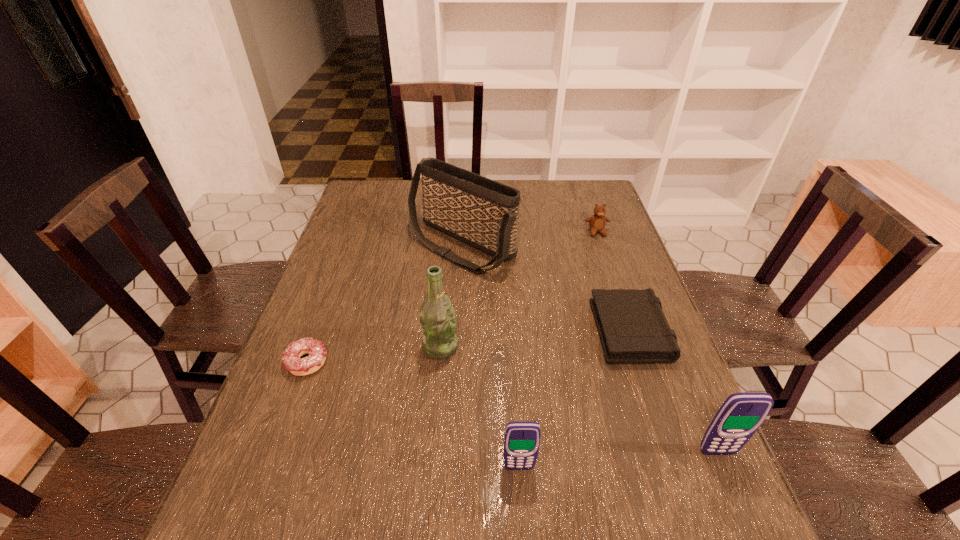
You are a GUI agent. You are given a task and a screenshot of the screen. Output one action in this format:
    pyautogui.click(x=<x>, y=<y>)
    Task: Click on the vacant space located at the face of the teddy bear
    
    Given the screenshot: What is the action you would take?
    [617, 291]

Locate an element on the screen. This screenshot has width=960, height=540. free region located 0.270m on the surface of the beer bottle is located at coordinates (568, 346).

Image resolution: width=960 pixels, height=540 pixels. In order to click on free location located on the right of the handbag in this screenshot , I will do `click(580, 246)`.

Locate an element on the screen. Image resolution: width=960 pixels, height=540 pixels. free space located on the front of the shortest object is located at coordinates (294, 398).

Find the location of a particular element. This screenshot has height=540, width=960. vacant region located on the front of the Bible is located at coordinates (654, 399).

Locate an element on the screen. object that is at the left edge is located at coordinates (291, 358).

Where is `cellular telephone present at the right edge`? Image resolution: width=960 pixels, height=540 pixels. cellular telephone present at the right edge is located at coordinates (741, 414).

Locate an element on the screen. The width and height of the screenshot is (960, 540). teddy bear present at the right edge is located at coordinates (597, 222).

This screenshot has width=960, height=540. I want to click on Bible at the right edge, so click(x=632, y=326).

This screenshot has width=960, height=540. Find the location of `object that is positioned at the near right corner`. object that is positioned at the near right corner is located at coordinates (741, 414).